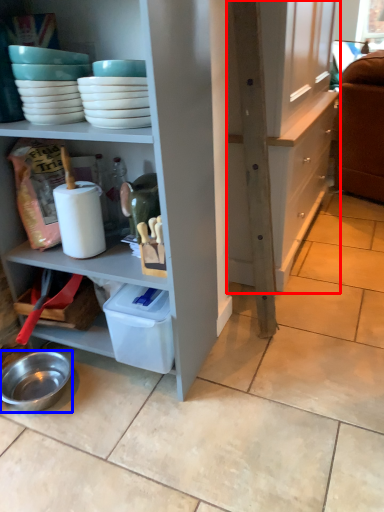
Question: Among these objects, which one is farthest to the camera, cabinetry (highlighted by a red box) or bowl (highlighted by a blue box)?

Choices:
 (A) cabinetry
 (B) bowl

Answer: (A)